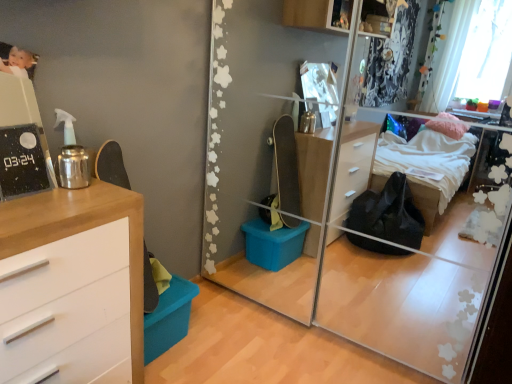
Question: Can you confirm if transparent glass mirror at center is bigger than wooden chest of drawers at left?

Choices:
 (A) no
 (B) yes

Answer: (B)

Question: Is transparent glass mirror at center beside wooden chest of drawers at left?

Choices:
 (A) yes
 (B) no

Answer: (B)

Question: From the image's perspective, is transparent glass mirror at center over wooden chest of drawers at left?

Choices:
 (A) no
 (B) yes

Answer: (B)

Question: From a real-world perspective, does transparent glass mirror at center sit lower than wooden chest of drawers at left?

Choices:
 (A) yes
 (B) no

Answer: (B)

Question: Is transparent glass mirror at center closer to camera compared to wooden chest of drawers at left?

Choices:
 (A) no
 (B) yes

Answer: (A)

Question: Is transparent glass mirror at center at the left side of wooden chest of drawers at left?

Choices:
 (A) no
 (B) yes

Answer: (A)

Question: Does wooden chest of drawers at left have a greater width compared to transparent glass mirror at center?

Choices:
 (A) yes
 (B) no

Answer: (B)

Question: From the image's perspective, is wooden chest of drawers at left on top of transparent glass mirror at center?

Choices:
 (A) yes
 (B) no

Answer: (B)

Question: Is wooden chest of drawers at left looking in the opposite direction of transparent glass mirror at center?

Choices:
 (A) no
 (B) yes

Answer: (A)

Question: From a real-world perspective, is wooden chest of drawers at left located higher than transparent glass mirror at center?

Choices:
 (A) no
 (B) yes

Answer: (A)

Question: Can you confirm if wooden chest of drawers at left is thinner than transparent glass mirror at center?

Choices:
 (A) no
 (B) yes

Answer: (B)

Question: Considering the relative sizes of wooden chest of drawers at left and transparent glass mirror at center in the image provided, is wooden chest of drawers at left smaller than transparent glass mirror at center?

Choices:
 (A) no
 (B) yes

Answer: (B)

Question: Is point (92, 357) closer or farther from the camera than point (418, 291)?

Choices:
 (A) closer
 (B) farther

Answer: (A)